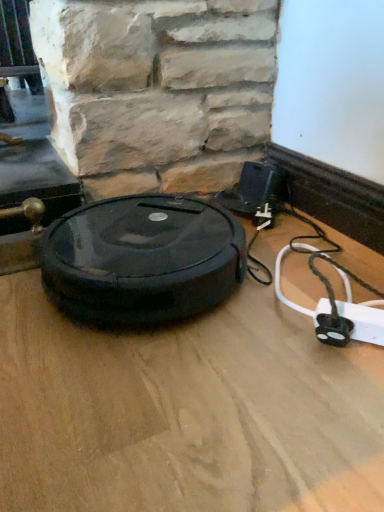
The image size is (384, 512). Describe the element at coordinates (363, 322) in the screenshot. I see `white plastic extension cord at lower right` at that location.

Locate an element on the screen. This screenshot has width=384, height=512. black rubber robot vacuum cleaner at center is located at coordinates (142, 259).

You are a GUI agent. You are given a task and a screenshot of the screen. Output one action in this format:
    pyautogui.click(x=<x>, y=<y>)
    Task: Click on the wooden floor at center
    
    Given the screenshot: What is the action you would take?
    pyautogui.click(x=185, y=411)

From a real-world perspective, does wooden floor at center stand above black rubber robot vacuum cleaner at center?

Actually, wooden floor at center is physically below black rubber robot vacuum cleaner at center in the real world.

How many degrees apart are the facing directions of wooden floor at center and black rubber robot vacuum cleaner at center?

86.9 degrees.

Are wooden floor at center and black rubber robot vacuum cleaner at center beside each other?

No, wooden floor at center is not in contact with black rubber robot vacuum cleaner at center.

Is wooden floor at center oriented away from black rubber robot vacuum cleaner at center?

Yes, wooden floor at center is positioned with its back facing black rubber robot vacuum cleaner at center.

Could you tell me if wooden floor at center is turned towards white plastic extension cord at lower right?

No.

From a real-world perspective, which object rests below the other?

wooden floor at center.

In terms of height, does wooden floor at center look taller or shorter compared to white plastic extension cord at lower right?

wooden floor at center is shorter than white plastic extension cord at lower right.

From a real-world perspective, relative to wooden floor at center, is black rubber robot vacuum cleaner at center vertically above or below?

From a real-world perspective, black rubber robot vacuum cleaner at center is physically above wooden floor at center.

Between black rubber robot vacuum cleaner at center and wooden floor at center, which one appears on the right side from the viewer's perspective?

black rubber robot vacuum cleaner at center is more to the right.

The image size is (384, 512). I want to click on car tire lying below the wooden floor at center (from the image's perspective), so click(x=142, y=259).

Considering the relative sizes of black rubber robot vacuum cleaner at center and wooden floor at center in the image provided, is black rubber robot vacuum cleaner at center taller than wooden floor at center?

Indeed, black rubber robot vacuum cleaner at center has a greater height compared to wooden floor at center.

Considering the sizes of white plastic extension cord at lower right and wooden floor at center in the image, is white plastic extension cord at lower right wider or thinner than wooden floor at center?

white plastic extension cord at lower right is thinner than wooden floor at center.

Can you tell me how much white plastic extension cord at lower right and wooden floor at center differ in facing direction?

white plastic extension cord at lower right and wooden floor at center are facing 129 degrees away from each other.

From a real-world perspective, relative to wooden floor at center, is white plastic extension cord at lower right vertically above or below?

white plastic extension cord at lower right is situated higher than wooden floor at center in the real world.

Is white plastic extension cord at lower right aimed at wooden floor at center?

No, white plastic extension cord at lower right is not oriented towards wooden floor at center.

Is white plastic extension cord at lower right oriented away from black rubber robot vacuum cleaner at center?

No, white plastic extension cord at lower right is not facing the opposite direction of black rubber robot vacuum cleaner at center.

In terms of width, does white plastic extension cord at lower right look wider or thinner when compared to black rubber robot vacuum cleaner at center?

In the image, white plastic extension cord at lower right appears to be more narrow than black rubber robot vacuum cleaner at center.

Which is behind, white plastic extension cord at lower right or black rubber robot vacuum cleaner at center?

black rubber robot vacuum cleaner at center is further away from the camera.

Does point (368, 318) appear closer or farther from the camera than point (98, 300)?

Point (368, 318) is positioned closer to the camera compared to point (98, 300).

From a real-world perspective, is black rubber robot vacuum cleaner at center below white plastic extension cord at lower right?

No.

Who is bigger, black rubber robot vacuum cleaner at center or white plastic extension cord at lower right?

Bigger between the two is black rubber robot vacuum cleaner at center.

Is black rubber robot vacuum cleaner at center in front of or behind white plastic extension cord at lower right in the image?

Clearly, black rubber robot vacuum cleaner at center is behind white plastic extension cord at lower right.

Could you tell me if black rubber robot vacuum cleaner at center is facing white plastic extension cord at lower right?

No, black rubber robot vacuum cleaner at center is not aimed at white plastic extension cord at lower right.

Find the location of `surface that appears on the left of black rubber robot vacuum cleaner at center`. surface that appears on the left of black rubber robot vacuum cleaner at center is located at coordinates (185, 411).

Image resolution: width=384 pixels, height=512 pixels. I want to click on extension cord behind the wooden floor at center, so click(363, 322).

Which object lies further to the anchor point black rubber robot vacuum cleaner at center, wooden floor at center or white plastic extension cord at lower right?

Based on the image, white plastic extension cord at lower right appears to be further to black rubber robot vacuum cleaner at center.

From the image, which object appears to be nearer to wooden floor at center, white plastic extension cord at lower right or black rubber robot vacuum cleaner at center?

black rubber robot vacuum cleaner at center is positioned closer to the anchor wooden floor at center.

Estimate the real-world distances between objects in this image. Which object is further from white plastic extension cord at lower right, wooden floor at center or black rubber robot vacuum cleaner at center?

black rubber robot vacuum cleaner at center lies further to white plastic extension cord at lower right than the other object.

When comparing their distances from black rubber robot vacuum cleaner at center, does white plastic extension cord at lower right or wooden floor at center seem further?

white plastic extension cord at lower right lies further to black rubber robot vacuum cleaner at center than the other object.

When comparing their distances from wooden floor at center, does black rubber robot vacuum cleaner at center or white plastic extension cord at lower right seem further?

white plastic extension cord at lower right lies further to wooden floor at center than the other object.

Estimate the real-world distances between objects in this image. Which object is further from white plastic extension cord at lower right, black rubber robot vacuum cleaner at center or wooden floor at center?

black rubber robot vacuum cleaner at center is positioned further to the anchor white plastic extension cord at lower right.

Where is `car tire located between wooden floor at center and white plastic extension cord at lower right in the left-right direction`? This screenshot has height=512, width=384. car tire located between wooden floor at center and white plastic extension cord at lower right in the left-right direction is located at coordinates (142, 259).